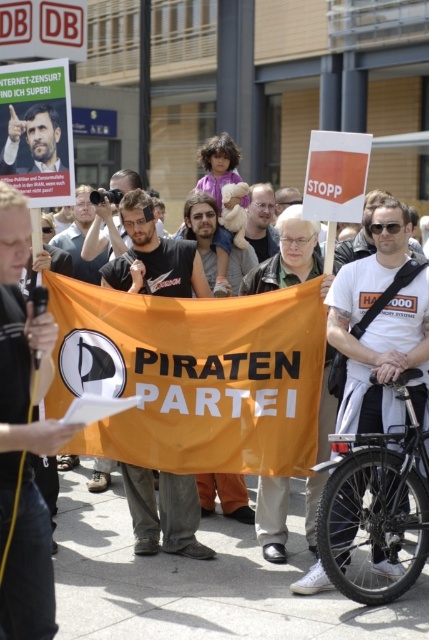
Question: Which object is positioned closest to the matte black poster at upper left?

Choices:
 (A) black leather pants at center
 (B) dark gray cotton t-shirt at center
 (C) matte black shirt at center

Answer: (B)

Question: Is dark gray cotton t-shirt at center to the left of matte black poster at upper left from the viewer's perspective?

Choices:
 (A) no
 (B) yes

Answer: (A)

Question: Does black leather pants at center have a lesser width compared to black matte bicycle at lower right?

Choices:
 (A) no
 (B) yes

Answer: (B)

Question: Which point is closer to the camera?

Choices:
 (A) (45, 570)
 (B) (12, 124)
 (C) (130, 500)

Answer: (A)

Question: Which object is closer to the camera taking this photo?

Choices:
 (A) black leather pants at center
 (B) black matte bicycle at lower right
 (C) dark gray cotton t-shirt at center

Answer: (A)

Question: Is black matte bicycle at lower right positioned before matte black poster at upper left?

Choices:
 (A) no
 (B) yes

Answer: (B)